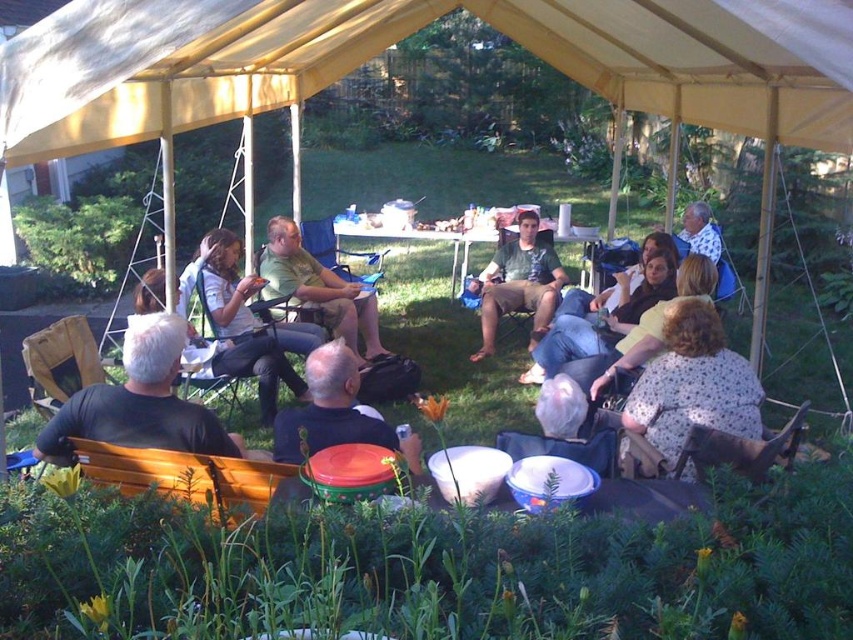
From the picture: Can you confirm if beige canvas canopy at upper center is taller than matte white shirt at center?

Incorrect, beige canvas canopy at upper center's height is not larger of matte white shirt at center's.

How distant is beige canvas canopy at upper center from matte white shirt at center?

beige canvas canopy at upper center and matte white shirt at center are 3.36 meters apart from each other.

Who is more distant from viewer, (103, 100) or (305, 353)?

Point (305, 353)

Identify the location of beige canvas canopy at upper center. The width and height of the screenshot is (853, 640). (403, 36).

Locate an element on the screen. The image size is (853, 640). yellow fabric tent at center is located at coordinates (403, 36).

Find the location of a particular element. yellow fabric tent at center is located at coordinates (403, 36).

I want to click on yellow fabric tent at center, so point(403,36).

Does light brown fabric dress at center come behind wooden folding chair at center?

Result: No.

Does light brown fabric dress at center appear on the right side of wooden folding chair at center?

Yes, light brown fabric dress at center is to the right of wooden folding chair at center.

Between point (646, 253) and point (354, 252), which one is positioned behind?

The point (354, 252) is behind.

At what (x,y) coordinates should I click in order to perform the action: click on light brown fabric dress at center. Please return your answer as a coordinate pair (x, y). Image resolution: width=853 pixels, height=640 pixels. Looking at the image, I should click on (601, 317).